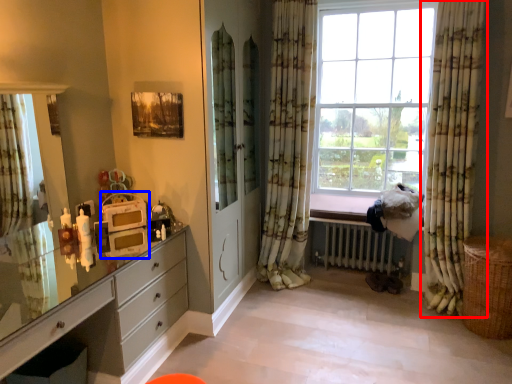
Question: Which object appears farthest to the camera in this image, curtain (highlighted by a red box) or appliance (highlighted by a blue box)?

Choices:
 (A) curtain
 (B) appliance

Answer: (A)